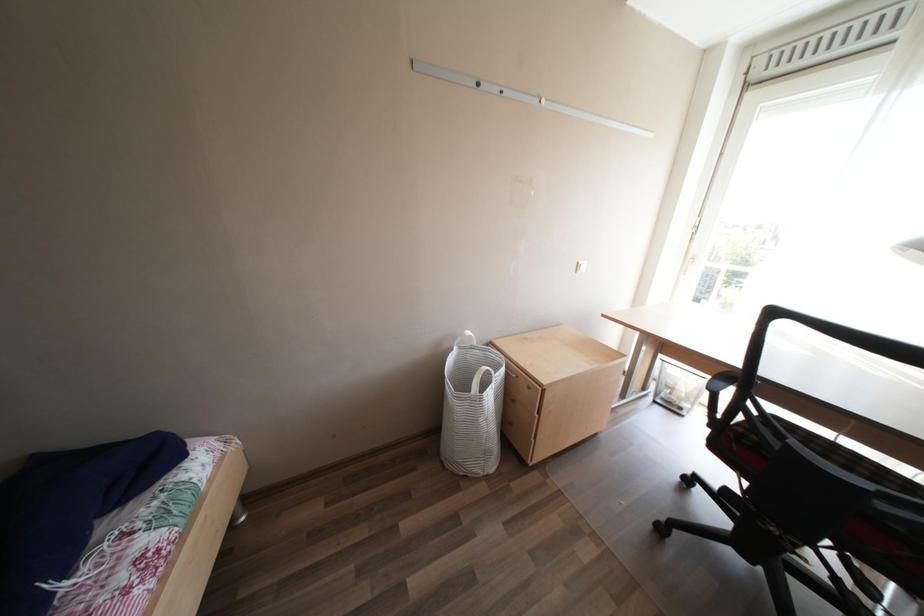
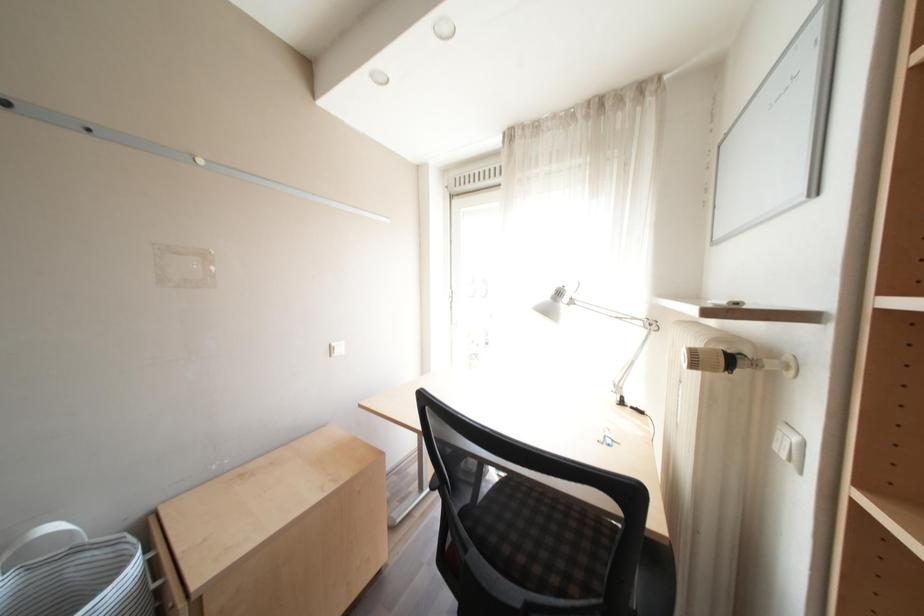
Question: The camera is either moving clockwise (left) or counter-clockwise (right) around the object. The first image is from the beginning of the video and the second image is from the end. Is the camera moving left or right when shooting the video?

Choices:
 (A) Left
 (B) Right

Answer: (A)